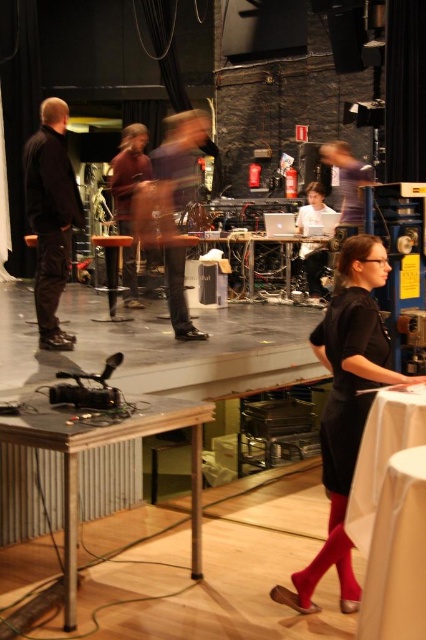
You are standing at the point labeled point (135, 138) and want to move to the point labeled point (382, 404). Is the point you want to reach in front of you or behind you?

The point labeled point (382, 404) is in front of point (135, 138), so the destination is in front of you.

You are a stagehand preparing to set up equipment. You need to place a heavy box on the white cloth at lower right. However, there is a brown leather jacket at center in the way. Can you place the box there without moving the jacket?

The white cloth at lower right is positioned under the brown leather jacket at center, so the jacket is currently on top of the cloth. To place the box on the cloth without moving the jacket, you would need to remove the jacket first since it is blocking the area.

You are standing in the backstage area and want to move from point A at point [376,385] to point B at point [172,308]. Which direction should you face to walk directly towards point B?

You should face towards the lower left direction to walk directly towards point B at point [172,308] from point A at point [376,385].